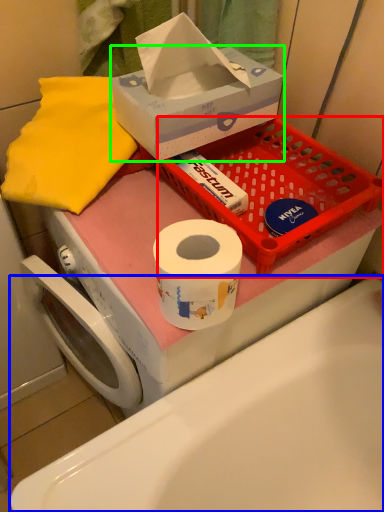
Question: Which is farther away from basket (highlighted by a red box)? bath (highlighted by a blue box) or box (highlighted by a green box)?

Choices:
 (A) bath
 (B) box

Answer: (A)